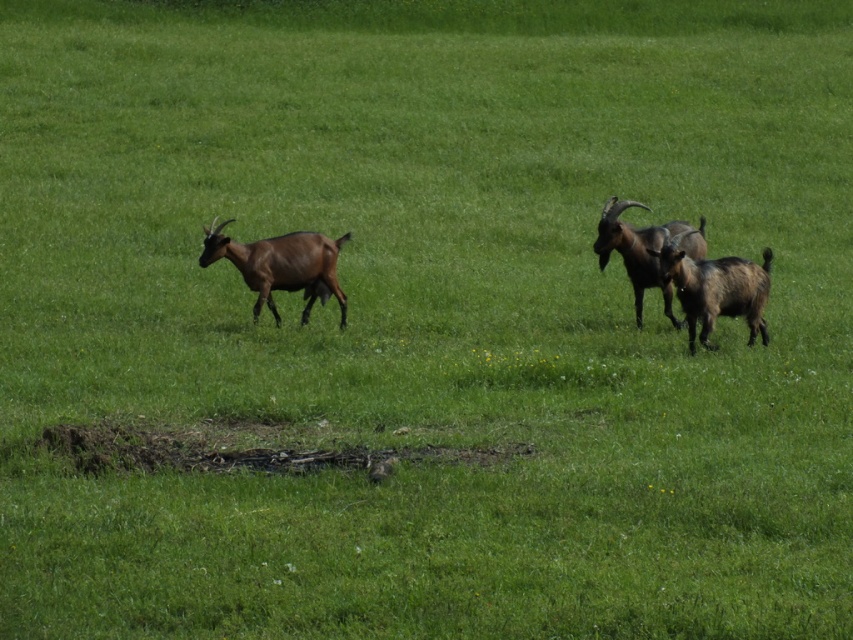
Question: Estimate the real-world distances between objects in this image. Which object is closer to the brown furry goat at center-right?

Choices:
 (A) brown woolen goat at left
 (B) brown fuzzy goat at center-right

Answer: (B)

Question: Which object is farther from the camera taking this photo?

Choices:
 (A) brown woolen goat at left
 (B) brown fuzzy goat at center-right

Answer: (A)

Question: Is brown woolen goat at left positioned behind brown fuzzy goat at center-right?

Choices:
 (A) no
 (B) yes

Answer: (B)

Question: Based on their relative distances, which object is farther from the brown furry goat at center-right?

Choices:
 (A) brown fuzzy goat at center-right
 (B) brown woolen goat at left

Answer: (B)

Question: Does brown woolen goat at left appear over brown fuzzy goat at center-right?

Choices:
 (A) no
 (B) yes

Answer: (B)

Question: Does brown woolen goat at left come in front of brown furry goat at center-right?

Choices:
 (A) no
 (B) yes

Answer: (B)